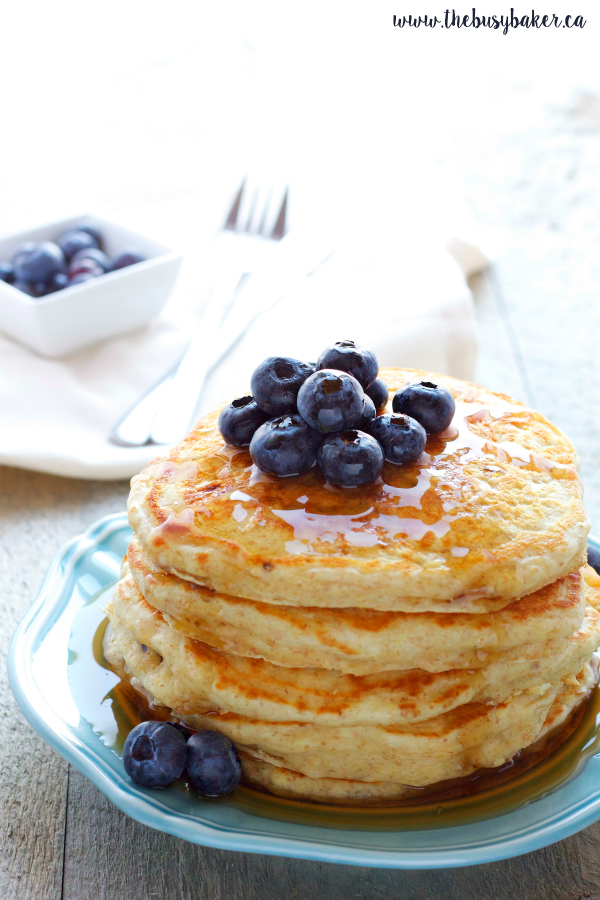
Image resolution: width=600 pixels, height=900 pixels. In order to click on plate in this screenshot , I will do `click(526, 820)`.